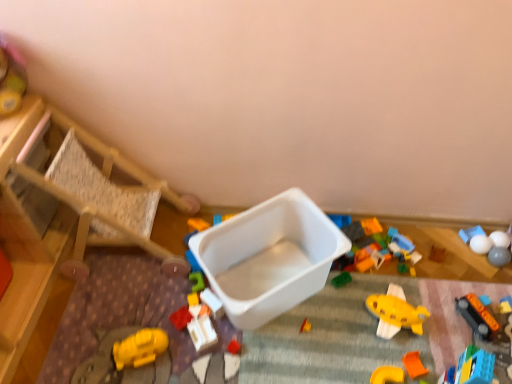
I want to click on free space in front of rubberized plastic toy at center, the thirteenth toy positioned from the right, so coord(181,360).